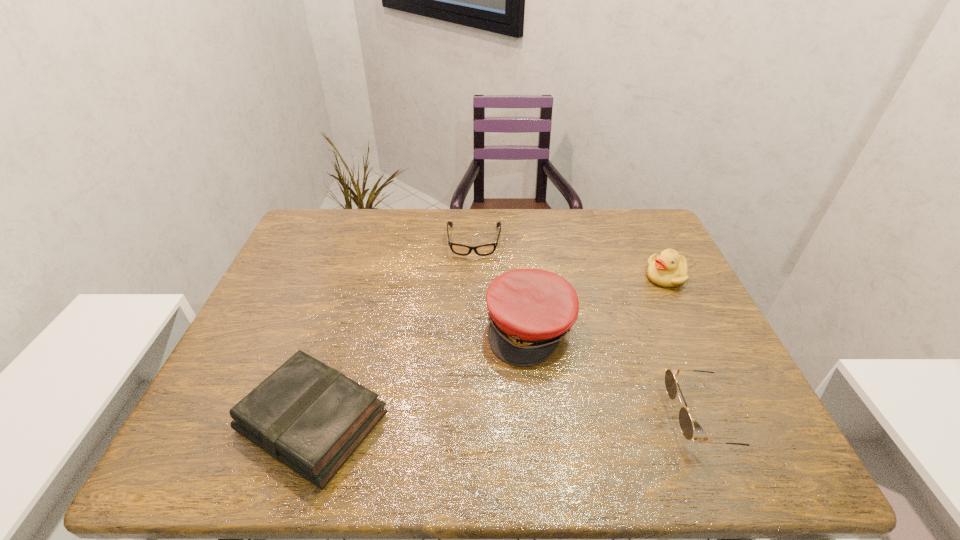
The height and width of the screenshot is (540, 960). In order to click on book in this screenshot , I will do `click(307, 415)`.

Identify the location of the second shortest object. The image size is (960, 540). (307, 415).

Where is `sunglasses`? This screenshot has width=960, height=540. sunglasses is located at coordinates (685, 421).

Locate an element on the screen. spectacles is located at coordinates (482, 250).

Where is `the shortest object`? the shortest object is located at coordinates (482, 250).

This screenshot has width=960, height=540. Find the location of `the tallest object`. the tallest object is located at coordinates (530, 310).

Find the location of `duckling`. duckling is located at coordinates (668, 269).

Find the location of a particular element. vacant space located on the right of the book is located at coordinates (440, 421).

Where is `vacant area situated 0.240m on the front lenses of the sunglasses`? The height and width of the screenshot is (540, 960). vacant area situated 0.240m on the front lenses of the sunglasses is located at coordinates (554, 418).

This screenshot has width=960, height=540. Identify the location of vacant space situated 0.090m on the front lenses of the sunglasses. click(627, 418).